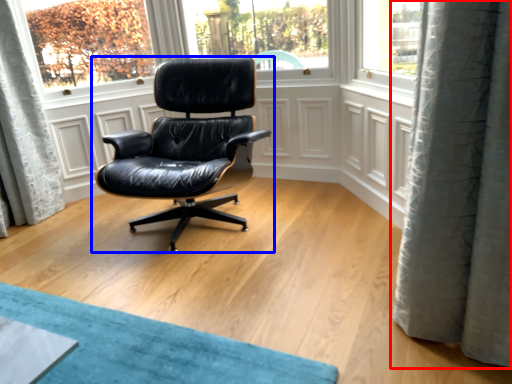
Question: Which point is further to the camera, curtain (highlighted by a red box) or chair (highlighted by a blue box)?

Choices:
 (A) curtain
 (B) chair

Answer: (B)